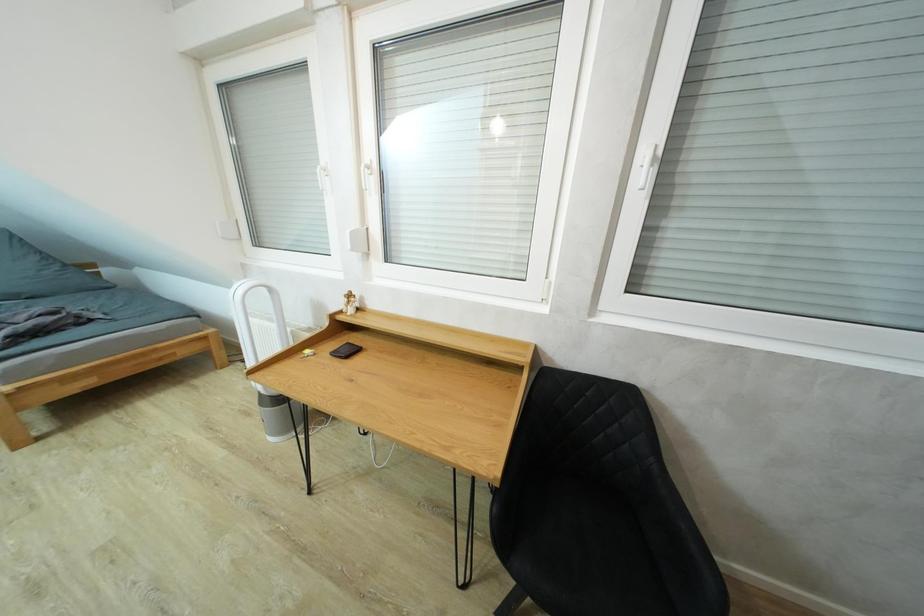
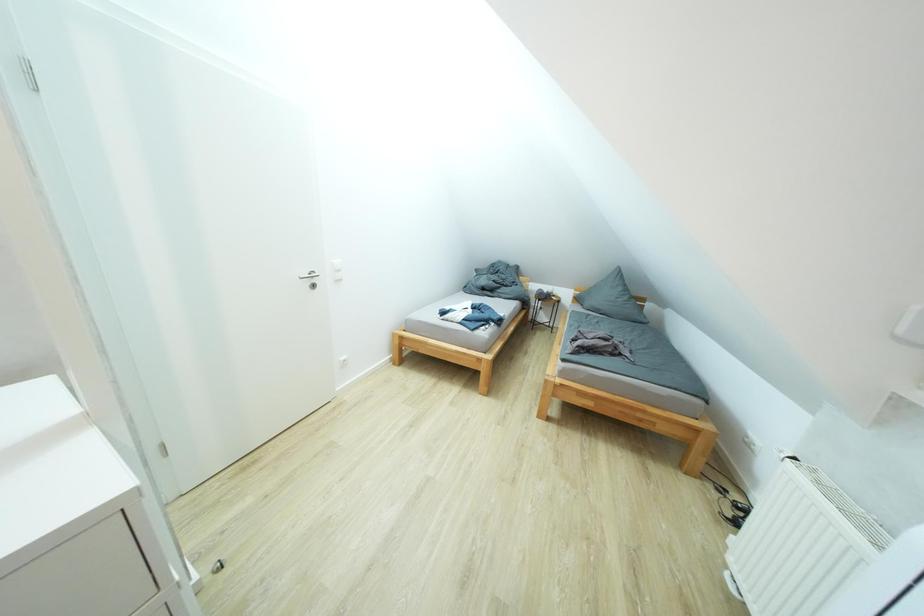
Question: The camera is either moving clockwise (left) or counter-clockwise (right) around the object. The first image is from the beginning of the video and the second image is from the end. Is the camera moving left or right when shooting the video?

Choices:
 (A) Left
 (B) Right

Answer: (B)